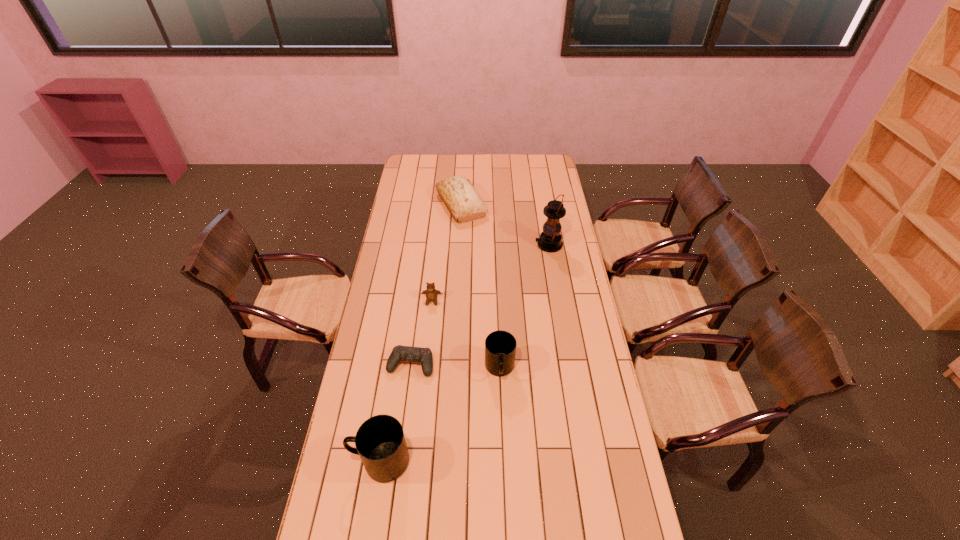
This screenshot has width=960, height=540. Find the location of `the nearer mug`. the nearer mug is located at coordinates (380, 442).

I want to click on the left mug, so click(380, 442).

What are the coordinates of `the farther mug` in the screenshot? It's located at (500, 346).

Locate an element on the screen. the shorter mug is located at coordinates (500, 346).

Locate an element on the screen. Image resolution: width=960 pixels, height=540 pixels. the third farthest object is located at coordinates (431, 293).

Locate an element on the screen. This screenshot has width=960, height=540. teddy bear is located at coordinates (431, 293).

Locate an element on the screen. The image size is (960, 540). the farthest object is located at coordinates (460, 197).

Identify the location of the tallest object. The image size is (960, 540). (550, 240).

Locate an element on the screen. the second farthest object is located at coordinates (550, 240).

You are a GUI agent. You are given a task and a screenshot of the screen. Output one action in this format:
    pyautogui.click(x=<x>, y=<y>)
    Task: Click on the control
    The width and height of the screenshot is (960, 540).
    Given the screenshot: What is the action you would take?
    pyautogui.click(x=399, y=353)